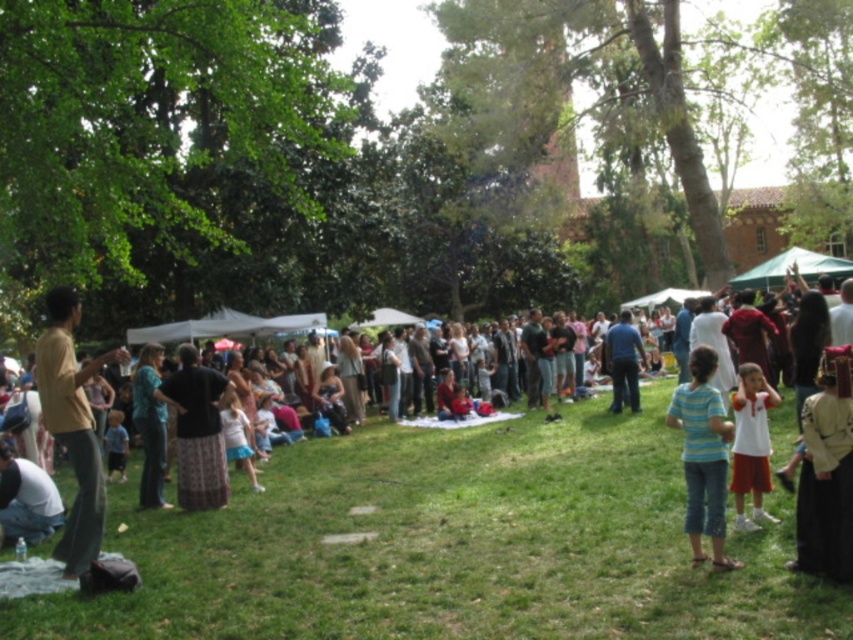
You are standing in the park and want to take a photo of both the point at (780,593) and the point at (849,483). Which point should you focus on first to ensure both are in focus?

You should focus on the point at (849,483) first because it is further away from the camera compared to the point at (780,593). By focusing on the farther point, both points will be within the depth of field and in focus.

You are a photographer trying to capture a photo of both the white cotton shirt at lower left and the teal fabric shirt at center. Since you want both shirts to be clearly visible in the frame, which one should you focus on first to ensure the taller shirt is in focus?

The teal fabric shirt at center is taller than the white cotton shirt at lower left. To ensure the taller shirt is in focus, you should focus on the teal fabric shirt at center first.

You are standing at the point marked as point (451, 545) in the image. What is the terrain like under your feet?

The terrain under your feet at point (451, 545) is green grass at center.